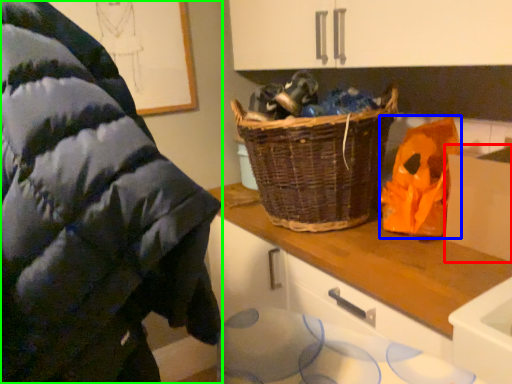
Question: Based on their relative distances, which object is farther from cardboard box (highlighted by a red box)? Choose from waste (highlighted by a blue box) and wool (highlighted by a green box).

Choices:
 (A) waste
 (B) wool

Answer: (B)